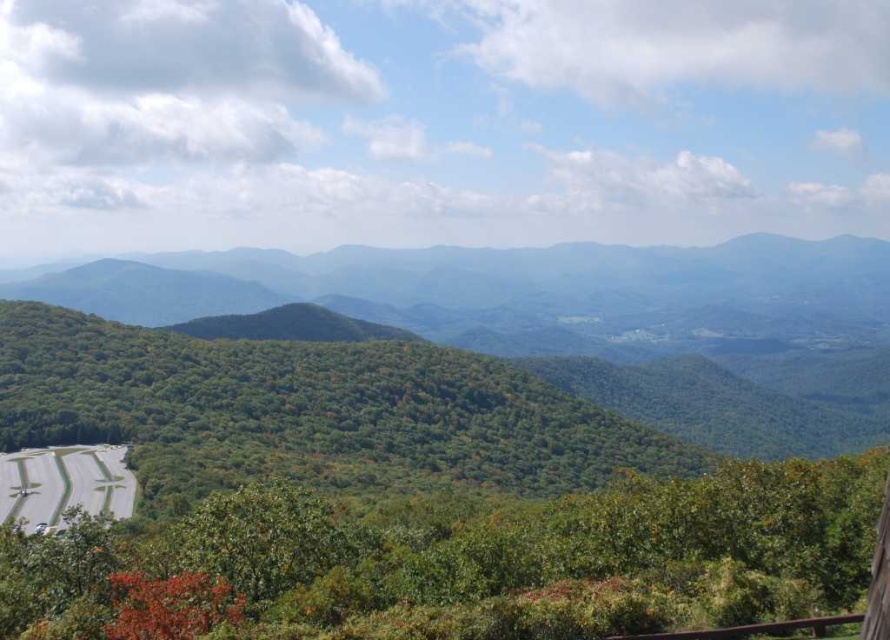
Does point (806, 284) come behind point (30, 509)?

Yes, point (806, 284) is behind point (30, 509).

Can you confirm if green leafy forest at left is positioned above green asphalt road at lower left?

Yes.

Describe the element at coordinates (579, 321) in the screenshot. Image resolution: width=890 pixels, height=640 pixels. I see `green leafy forest at left` at that location.

Identify the location of green leafy forest at left. Image resolution: width=890 pixels, height=640 pixels. (579, 321).